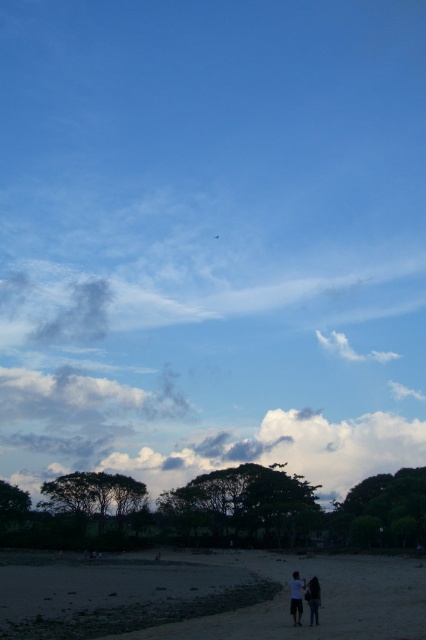
You are standing on the beach and see the dark green leafy tree at center. If you walk 10 meters directly towards the tree, will you be able to see the tree in the same position relative to the horizon?

Yes, because the dark green leafy tree at center is located at point (242, 508), which is fixed in the scene. Moving towards it won,t change its position relative to the horizon.

You are standing on the sandy beach at lower center and see the white cotton shirt at lower center nearby. Which object occupies more space in the scene?

The sandy beach at lower center has a larger size compared to the white cotton shirt at lower center, so the sandy beach at lower center occupies more space in the scene.

You are standing on the beach and see the dark green leafy tree at center and the green leafy tree at lower center. Which tree would cast a longer shadow on the sand?

The dark green leafy tree at center is much taller than the green leafy tree at lower center, so it would cast a longer shadow on the sand.